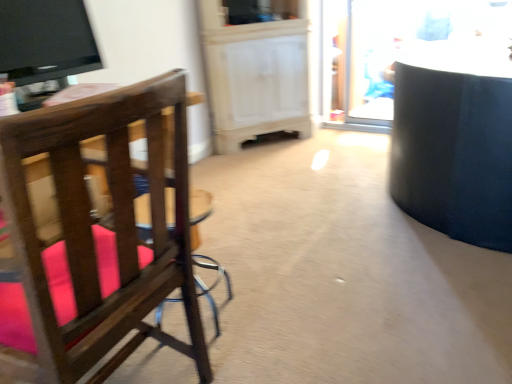
Locate an element on the screen. The width and height of the screenshot is (512, 384). black glossy tv at upper left is located at coordinates (45, 40).

What do you see at coordinates (98, 234) in the screenshot? This screenshot has height=384, width=512. I see `wooden chair with pink cushions at left` at bounding box center [98, 234].

The width and height of the screenshot is (512, 384). In order to click on black glossy tv at upper left in this screenshot , I will do `click(45, 40)`.

From a real-world perspective, is black glossy tv at upper left physically above wooden bar stool at center?

Yes, from a real-world perspective, black glossy tv at upper left is on top of wooden bar stool at center.

From the image's perspective, which one is positioned higher, black glossy tv at upper left or wooden bar stool at center?

black glossy tv at upper left, from the image's perspective.

Considering the points (41, 30) and (111, 218), which point is behind, point (41, 30) or point (111, 218)?

Point (41, 30)

How distant is black glossy tv at upper left from wooden bar stool at center?

They are 3.43 feet apart.

Is wooden chair with pink cushions at left facing away from transparent glass door at upper right?

No, wooden chair with pink cushions at left is not facing the opposite direction of transparent glass door at upper right.

From a real-world perspective, is wooden chair with pink cushions at left physically below transparent glass door at upper right?

Yes, from a real-world perspective, wooden chair with pink cushions at left is under transparent glass door at upper right.

Is wooden chair with pink cushions at left taller or shorter than transparent glass door at upper right?

Clearly, wooden chair with pink cushions at left is shorter compared to transparent glass door at upper right.

Considering the relative positions of wooden chair with pink cushions at left and transparent glass door at upper right in the image provided, is wooden chair with pink cushions at left to the right of transparent glass door at upper right from the viewer's perspective?

No.

From a real-world perspective, which is physically above, transparent glass door at upper right or black glossy tv at upper left?

black glossy tv at upper left.

Considering the positions of point (355, 45) and point (21, 83), is point (355, 45) closer or farther from the camera than point (21, 83)?

Point (355, 45).

What's the angular difference between transparent glass door at upper right and black glossy tv at upper left's facing directions?

transparent glass door at upper right and black glossy tv at upper left are facing 84.2 degrees away from each other.

How much distance is there between transparent glass door at upper right and black glossy tv at upper left?

6.98 feet.

Between transparent glass door at upper right and wooden bar stool at center, which one has larger size?

Bigger between the two is transparent glass door at upper right.

Is transparent glass door at upper right further to the viewer compared to wooden bar stool at center?

That is True.

Between transparent glass door at upper right and wooden bar stool at center, which one has larger width?

wooden bar stool at center is wider.

From a real-world perspective, is transparent glass door at upper right on wooden bar stool at center?

Indeed, from a real-world perspective, transparent glass door at upper right stands above wooden bar stool at center.

Considering the relative sizes of wooden chair with pink cushions at left and black glossy tv at upper left in the image provided, is wooden chair with pink cushions at left taller than black glossy tv at upper left?

Yes, wooden chair with pink cushions at left is taller than black glossy tv at upper left.

At what (x,y) coordinates should I click in order to perform the action: click on television above the wooden chair with pink cushions at left (from the image's perspective). Please return your answer as a coordinate pair (x, y). The height and width of the screenshot is (384, 512). Looking at the image, I should click on (45, 40).

Would you say black glossy tv at upper left is part of wooden chair with pink cushions at left's contents?

No, wooden chair with pink cushions at left does not contain black glossy tv at upper left.

From a real-world perspective, is black glossy tv at upper left over wooden chair with pink cushions at left?

Indeed, from a real-world perspective, black glossy tv at upper left stands above wooden chair with pink cushions at left.

Is black glossy tv at upper left positioned with its back to wooden chair with pink cushions at left?

No.

Considering the relative positions of black glossy tv at upper left and wooden chair with pink cushions at left in the image provided, is black glossy tv at upper left to the left of wooden chair with pink cushions at left from the viewer's perspective?

Yes, black glossy tv at upper left is to the left of wooden chair with pink cushions at left.

Based on the photo, which is less distant, (19, 6) or (23, 218)?

The point (23, 218) is more forward.

In the scene shown: Which object is positioned more to the left, transparent glass door at upper right or wooden chair with pink cushions at left?

wooden chair with pink cushions at left is more to the left.

Is transparent glass door at upper right positioned with its back to wooden chair with pink cushions at left?

transparent glass door at upper right does not have its back to wooden chair with pink cushions at left.

From a real-world perspective, is transparent glass door at upper right positioned over wooden chair with pink cushions at left based on gravity?

Yes, from a real-world perspective, transparent glass door at upper right is on top of wooden chair with pink cushions at left.

Is transparent glass door at upper right not near wooden chair with pink cushions at left?

Yes, transparent glass door at upper right is far from wooden chair with pink cushions at left.

Where is `bar stool lying in front of the black glossy tv at upper left`? bar stool lying in front of the black glossy tv at upper left is located at coordinates (211, 285).

You are a GUI agent. You are given a task and a screenshot of the screen. Output one action in this format:
    pyautogui.click(x=<x>, y=<y>)
    Task: Click on the chair located on the left of transparent glass door at upper right
    The height and width of the screenshot is (384, 512).
    Given the screenshot: What is the action you would take?
    pyautogui.click(x=98, y=234)

Based on the photo, which object lies nearer to the anchor point wooden chair with pink cushions at left, black glossy tv at upper left or wooden bar stool at center?

Among the two, wooden bar stool at center is located nearer to wooden chair with pink cushions at left.

Consider the image. Estimate the real-world distances between objects in this image. Which object is closer to black glossy tv at upper left, transparent glass door at upper right or wooden bar stool at center?

wooden bar stool at center.

From the image, which object appears to be farther from wooden chair with pink cushions at left, transparent glass door at upper right or wooden bar stool at center?

Based on the image, transparent glass door at upper right appears to be further to wooden chair with pink cushions at left.

In the scene shown: Considering their positions, is wooden chair with pink cushions at left positioned further to black glossy tv at upper left than wooden bar stool at center?

wooden chair with pink cushions at left is positioned further to the anchor black glossy tv at upper left.

When comparing their distances from black glossy tv at upper left, does transparent glass door at upper right or wooden chair with pink cushions at left seem further?

The object further to black glossy tv at upper left is transparent glass door at upper right.

Looking at the image, which one is located closer to wooden bar stool at center, black glossy tv at upper left or transparent glass door at upper right?

Based on the image, black glossy tv at upper left appears to be nearer to wooden bar stool at center.

When comparing their distances from transparent glass door at upper right, does wooden bar stool at center or wooden chair with pink cushions at left seem closer?

wooden bar stool at center is positioned closer to the anchor transparent glass door at upper right.

Which object lies further to the anchor point wooden chair with pink cushions at left, black glossy tv at upper left or transparent glass door at upper right?

Based on the image, transparent glass door at upper right appears to be further to wooden chair with pink cushions at left.

Locate an element on the screen. Image resolution: width=512 pixels, height=384 pixels. bar stool between black glossy tv at upper left and transparent glass door at upper right from left to right is located at coordinates (211, 285).

Locate an element on the screen. The height and width of the screenshot is (384, 512). bar stool between wooden chair with pink cushions at left and black glossy tv at upper left in the front-back direction is located at coordinates (211, 285).

Identify the location of bar stool between wooden chair with pink cushions at left and transparent glass door at upper right from front to back. Image resolution: width=512 pixels, height=384 pixels. (211, 285).

You are a GUI agent. You are given a task and a screenshot of the screen. Output one action in this format:
    pyautogui.click(x=<x>, y=<y>)
    Task: Click on the television between wooden chair with pink cushions at left and transparent glass door at upper right along the z-axis
    This screenshot has width=512, height=384.
    Given the screenshot: What is the action you would take?
    pyautogui.click(x=45, y=40)